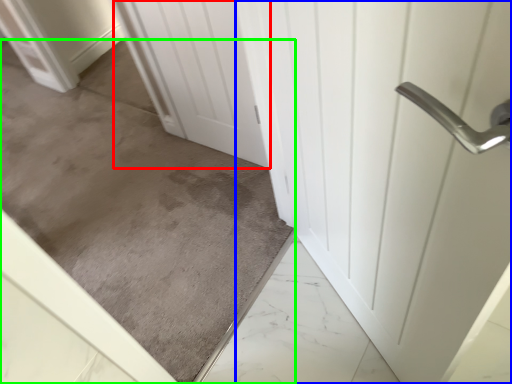
Question: Based on their relative distances, which object is farther from door (highlighted by a red box)? Choose from door (highlighted by a blue box) and concrete (highlighted by a green box).

Choices:
 (A) door
 (B) concrete

Answer: (A)